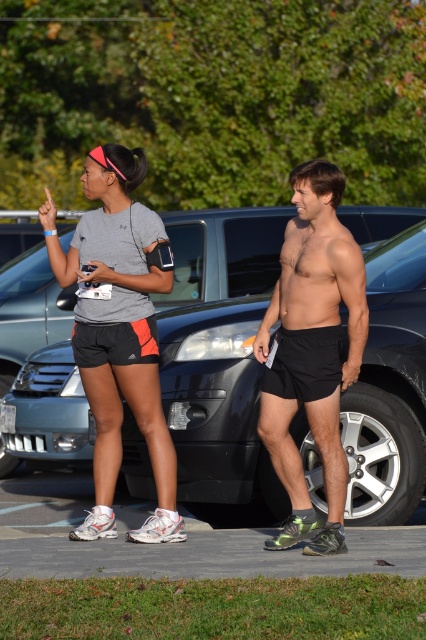
You are a photographer trying to capture a candid shot of both the matte gray shirt at center and the black mesh shorts at center. Since you want to ensure both are fully visible in the frame, which object should you focus on to maintain their visibility?

The matte gray shirt at center is taller than the black mesh shorts at center, so focusing on the matte gray shirt at center will ensure both are visible as it is the taller object.